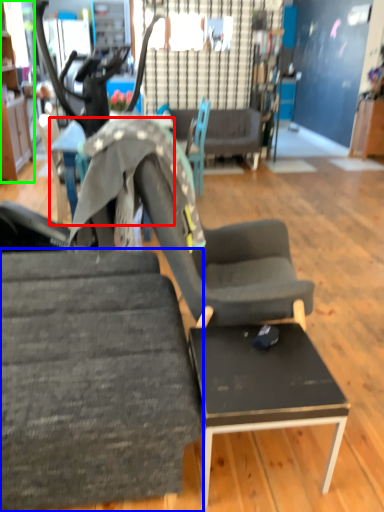
Question: Estimate the real-world distances between objects in this image. Which object is closer to table (highlighted by a red box), chair (highlighted by a blue box) or cabinetry (highlighted by a green box)?

Choices:
 (A) chair
 (B) cabinetry

Answer: (A)